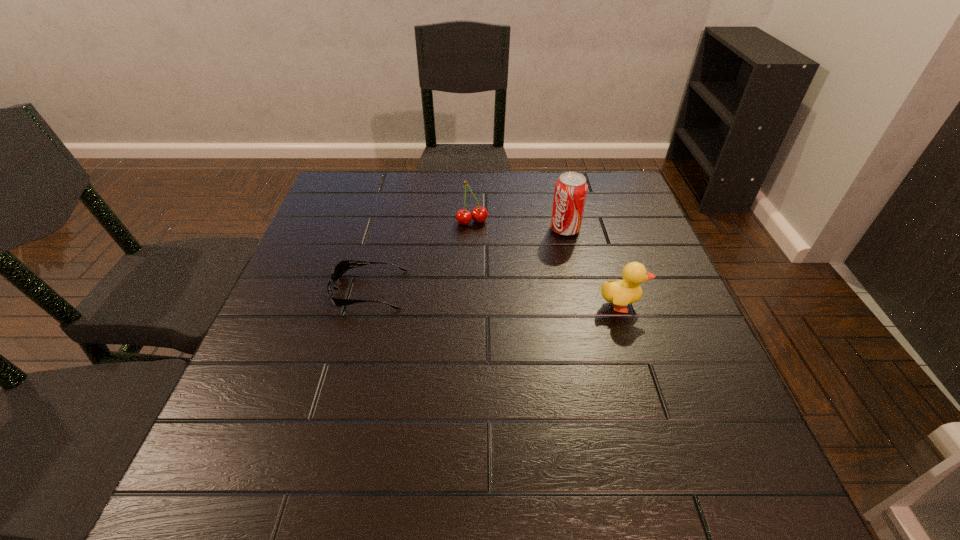
Where is `sunglasses`? This screenshot has height=540, width=960. sunglasses is located at coordinates (343, 266).

Locate an element on the screen. the leftmost object is located at coordinates (343, 266).

You are a GUI agent. You are given a task and a screenshot of the screen. Output one action in this format:
    pyautogui.click(x=<x>, y=<y>)
    Task: Click on the duckling
    The image size is (960, 540).
    Given the screenshot: What is the action you would take?
    pyautogui.click(x=620, y=293)

Locate an element on the screen. The width and height of the screenshot is (960, 540). cherry is located at coordinates (479, 214).

Where is `the tallest object`? The image size is (960, 540). the tallest object is located at coordinates (571, 188).

Where is `free space located 0.090m on the front-facing side of the duckling`? The width and height of the screenshot is (960, 540). free space located 0.090m on the front-facing side of the duckling is located at coordinates [684, 305].

The image size is (960, 540). What are the coordinates of `vacant space located with the stems of the third object from right to left pointing upwards` in the screenshot? It's located at (520, 325).

The image size is (960, 540). I want to click on free space located 0.250m with the stems of the third object from right to left pointing upwards, so click(x=504, y=291).

This screenshot has height=540, width=960. Find the location of `blank space located 0.360m with the stems of the third object from right to left pointing upwards`. blank space located 0.360m with the stems of the third object from right to left pointing upwards is located at coordinates (520, 325).

In order to click on vacant space located 0.290m on the logo side of the tallest object in this screenshot , I will do `click(478, 290)`.